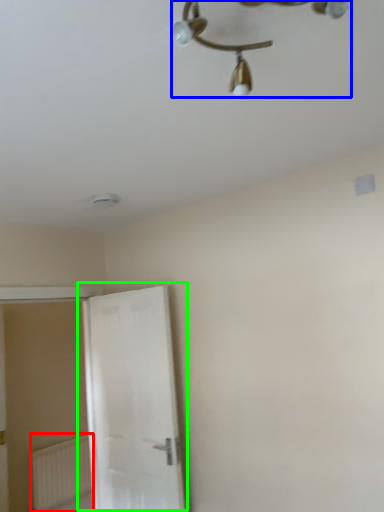
Question: Which object is positioned closest to radiator (highlighted by a red box)? Select from lamp (highlighted by a blue box) and door (highlighted by a green box).

Choices:
 (A) lamp
 (B) door

Answer: (B)